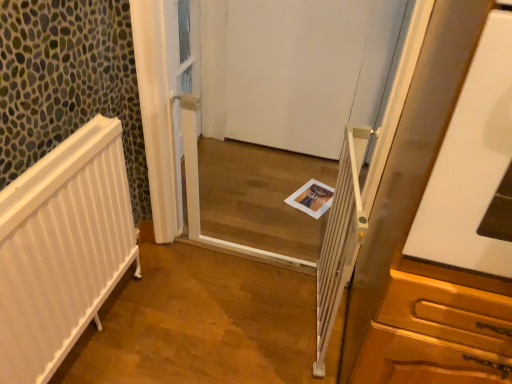
At what (x,y) coordinates should I click in order to perform the action: click on vacant area that lies between white matte door at center and white paper magazine at center. Please return your answer as a coordinate pair (x, y). Looking at the image, I should click on click(x=278, y=165).